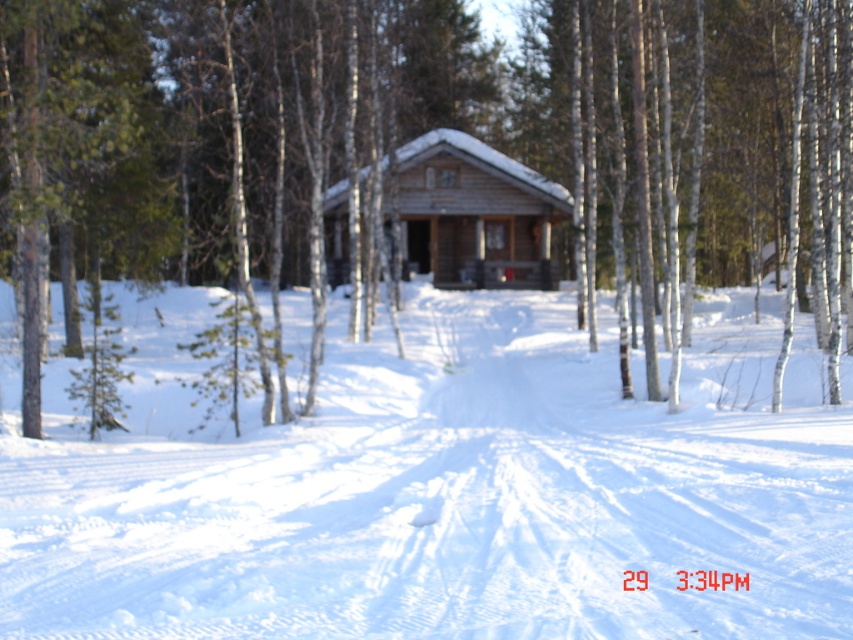
You are planning to build a snowman using the white powdery snow at center near the brown wood log cabin at center. Considering the cabin might be wider than the snow area, will there be enough space to build the snowman beside the cabin without encroaching on the snow area?

The brown wood log cabin at center might be wider than the white powdery snow at center, so there might not be enough space to build the snowman beside the cabin without overlapping the snow area. Check the actual dimensions before proceeding.

You are planning to build a snowman using the white powdery snow at center near the wooden cabin at center. Considering their sizes, which one has a greater width?

The white powdery snow at center has a greater width than the wooden cabin at center according to the description.

You are standing in the winter forest and see the brown wood log cabin at center and the white powdery snow at center. Which object is taller?

The brown wood log cabin at center is much taller than the white powdery snow at center.